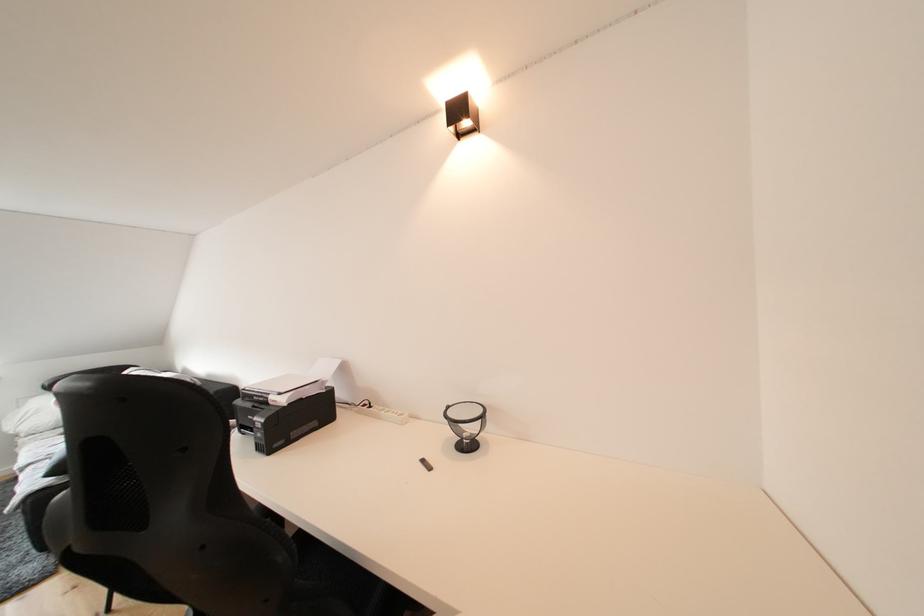
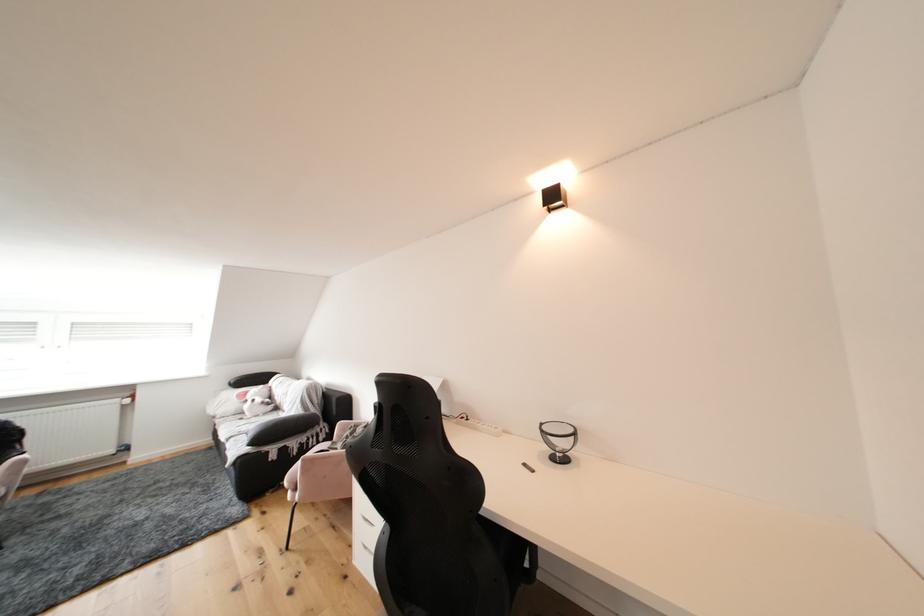
Locate, in the second image, the point that corresponds to (x=458, y=416) in the first image.

(553, 432)